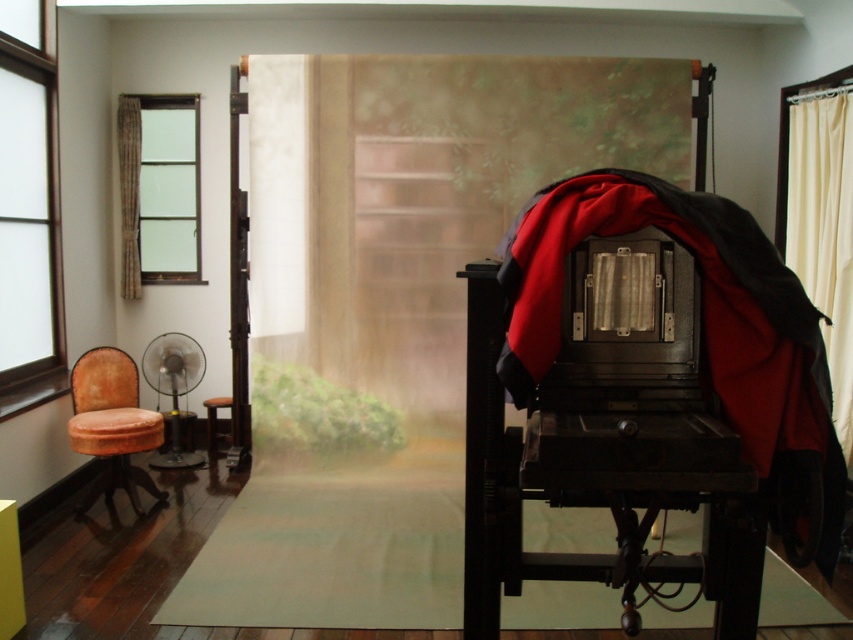
Is velvet orange armchair at left wider than floral fabric curtain at left?

Yes, velvet orange armchair at left is wider than floral fabric curtain at left.

The image size is (853, 640). What are the coordinates of `velvet orange armchair at left` in the screenshot? It's located at 112,424.

Is point (126, 394) positioned before point (117, 129)?

Yes, it is in front of point (117, 129).

The width and height of the screenshot is (853, 640). In order to click on velvet orange armchair at left in this screenshot , I will do `click(112, 424)`.

Is red fabric curtain at center thinner than velvet orange stool at lower left?

In fact, red fabric curtain at center might be wider than velvet orange stool at lower left.

Can you confirm if red fabric curtain at center is wider than velvet orange stool at lower left?

Indeed, red fabric curtain at center has a greater width compared to velvet orange stool at lower left.

Image resolution: width=853 pixels, height=640 pixels. What do you see at coordinates (421, 193) in the screenshot?
I see `red fabric curtain at center` at bounding box center [421, 193].

Locate an element on the screen. red fabric curtain at center is located at coordinates 421,193.

Is floral fabric curtain at left shorter than velvet orange stool at lower left?

Incorrect, floral fabric curtain at left's height does not fall short of velvet orange stool at lower left's.

Is floral fabric curtain at left smaller than velvet orange stool at lower left?

Yes.

I want to click on floral fabric curtain at left, so click(x=129, y=192).